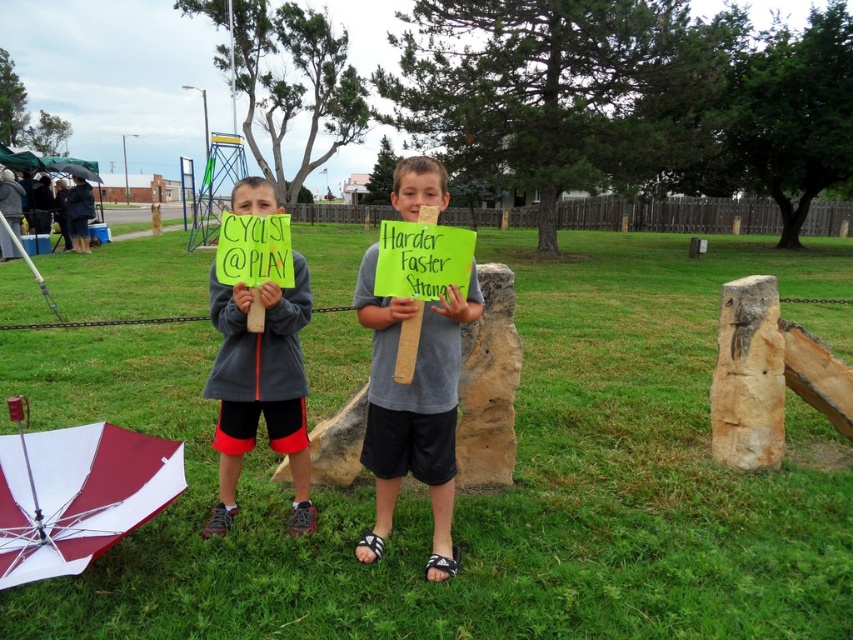
Question: Which object is farther from the camera taking this photo?

Choices:
 (A) green grass at center
 (B) gray fleece sweatshirt at center
 (C) gray fabric shirt at center

Answer: (B)

Question: Is green grass at center further to the viewer compared to gray fleece sweatshirt at center?

Choices:
 (A) no
 (B) yes

Answer: (A)

Question: Is green grass at center thinner than gray fabric shirt at center?

Choices:
 (A) yes
 (B) no

Answer: (B)

Question: Estimate the real-world distances between objects in this image. Which object is farther from the maroon and white fabric umbrella at center?

Choices:
 (A) green grass at center
 (B) gray fleece sweatshirt at center

Answer: (A)

Question: Based on their relative distances, which object is nearer to the green grass at center?

Choices:
 (A) gray fabric shirt at center
 (B) maroon and white fabric umbrella at center

Answer: (B)

Question: Observing the image, what is the correct spatial positioning of green grass at center in reference to gray fleece sweatshirt at center?

Choices:
 (A) left
 (B) right

Answer: (B)